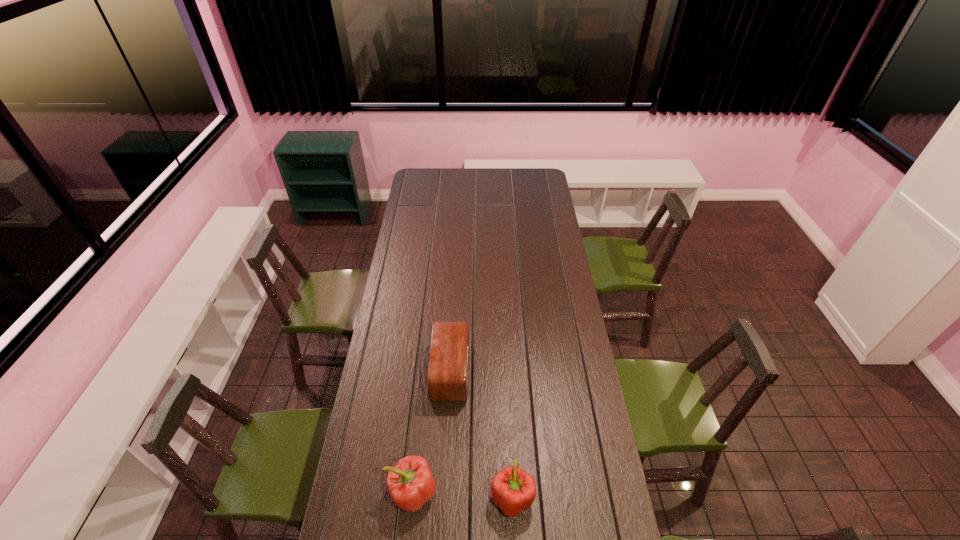
Where is `object that is the second closest one to the right bell pepper`? The image size is (960, 540). object that is the second closest one to the right bell pepper is located at coordinates (447, 380).

Identify which object is located as the second nearest to the left bell pepper. Please provide its 2D coordinates. Your answer should be formatted as a tuple, i.e. [(x, y)], where the tuple contains the x and y coordinates of a point satisfying the conditions above.

[(447, 380)]

The image size is (960, 540). Find the location of `vacant space that satisfies the following two spatial constraints: 1. on the front panel of the farthest object; 2. on the back side of the rightmost object`. vacant space that satisfies the following two spatial constraints: 1. on the front panel of the farthest object; 2. on the back side of the rightmost object is located at coordinates (444, 497).

Locate an element on the screen. vacant area in the image that satisfies the following two spatial constraints: 1. on the front panel of the farthest object; 2. on the front side of the left bell pepper is located at coordinates (444, 492).

I want to click on vacant region that satisfies the following two spatial constraints: 1. on the front panel of the farthest object; 2. on the left side of the right bell pepper, so tap(444, 497).

You are a GUI agent. You are given a task and a screenshot of the screen. Output one action in this format:
    pyautogui.click(x=<x>, y=<y>)
    Task: Click on the blank area in the image that satisfies the following two spatial constraints: 1. on the front panel of the radio receiver; 2. on the right side of the rightmost object
    The height and width of the screenshot is (540, 960).
    Given the screenshot: What is the action you would take?
    pyautogui.click(x=444, y=497)

Image resolution: width=960 pixels, height=540 pixels. Find the location of `free space that satisfies the following two spatial constraints: 1. on the front panel of the radio receiver; 2. on the right side of the right bell pepper`. free space that satisfies the following two spatial constraints: 1. on the front panel of the radio receiver; 2. on the right side of the right bell pepper is located at coordinates (444, 497).

I want to click on vacant position in the image that satisfies the following two spatial constraints: 1. on the front panel of the farthest object; 2. on the left side of the right bell pepper, so click(x=444, y=497).

Identify the location of vacant region that satisfies the following two spatial constraints: 1. on the front panel of the radio receiver; 2. on the back side of the rightmost object. The height and width of the screenshot is (540, 960). (444, 497).

At what (x,y) coordinates should I click in order to perform the action: click on blank space that satisfies the following two spatial constraints: 1. on the front panel of the radio receiver; 2. on the left side of the right bell pepper. Please return your answer as a coordinate pair (x, y). This screenshot has width=960, height=540. Looking at the image, I should click on (444, 497).